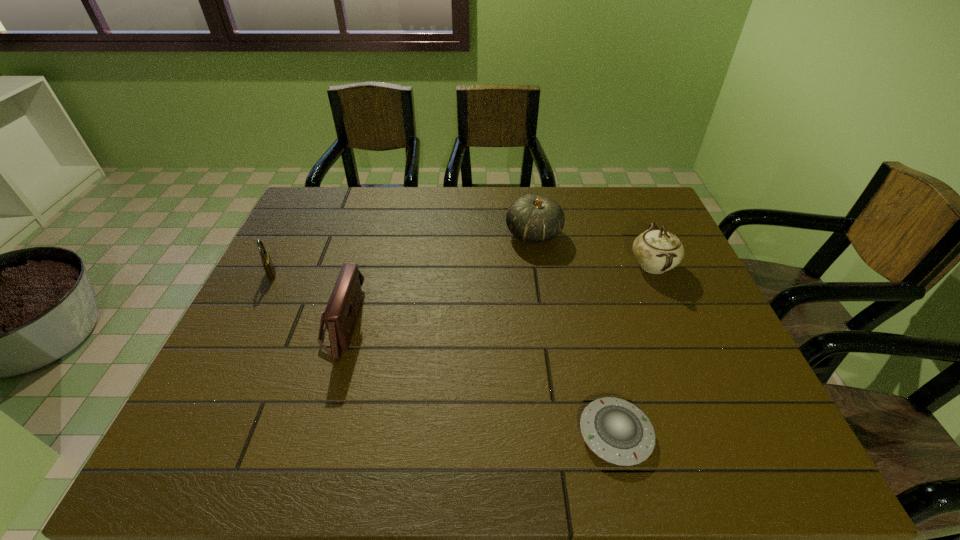
Locate an element on the screen. This screenshot has height=540, width=960. free region at the near right corner of the desktop is located at coordinates (734, 458).

Identify the location of vacant area that lies between the shoulder bag and the gourd. This screenshot has height=540, width=960. (438, 279).

You are a GUI agent. You are given a task and a screenshot of the screen. Output one action in this format:
    pyautogui.click(x=<x>, y=<y>)
    Task: Click on the free space between the rightmost object and the padlock
    The width and height of the screenshot is (960, 540).
    Given the screenshot: What is the action you would take?
    pyautogui.click(x=462, y=269)

In order to click on empty space between the gourd and the leftmost object in this screenshot , I will do `click(403, 254)`.

Identify the location of empty space that is in between the nearest object and the shoulder bag. Image resolution: width=960 pixels, height=540 pixels. (479, 379).

Locate an element on the screen. free space between the padlock and the nearest object is located at coordinates (444, 354).

Where is `free space between the gourd and the rightmost object`? free space between the gourd and the rightmost object is located at coordinates (593, 250).

You are a GUI agent. You are given a task and a screenshot of the screen. Output one action in this format:
    pyautogui.click(x=<x>, y=<y>)
    Task: Click on the empty space that is in between the shoulder bag and the padlock
    
    Given the screenshot: What is the action you would take?
    pyautogui.click(x=307, y=299)

You are a GUI agent. You are given a task and a screenshot of the screen. Output one action in this format:
    pyautogui.click(x=<x>, y=<y>)
    Task: Click on the unoccupied area between the rightmost object and the leftmost object
    This screenshot has width=960, height=540.
    Given the screenshot: What is the action you would take?
    pyautogui.click(x=462, y=269)

At what (x,y) coordinates should I click in order to perform the action: click on blank region between the shoulder bag and the leftmost object. Please return your answer as a coordinate pair (x, y). This screenshot has height=540, width=960. Looking at the image, I should click on (307, 299).